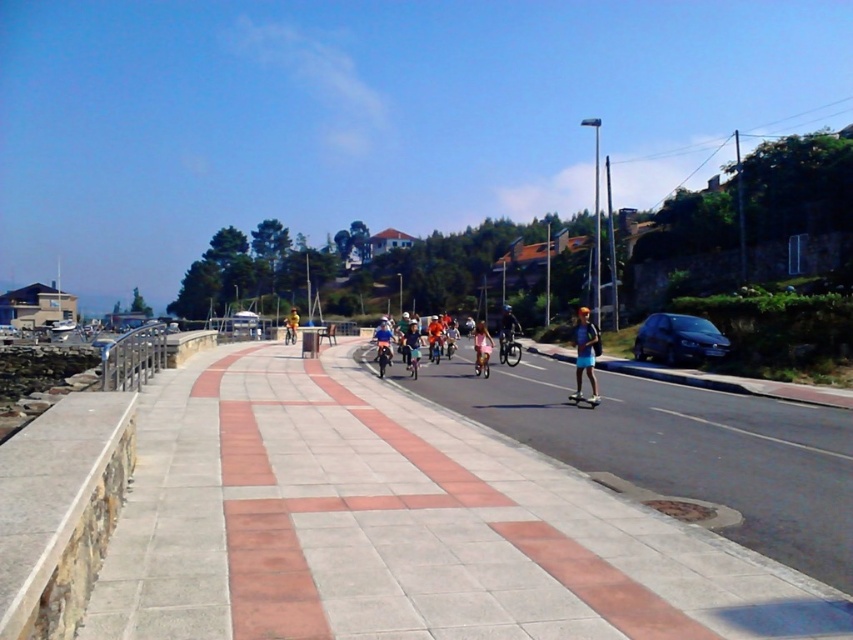
You are a photographer standing on the waterfront promenade. You want to capture a photo of the brick paved sidewalk at center without any people in the frame. Is the light blue shorts at center currently blocking your view of the sidewalk?

Yes, the brick paved sidewalk at center is positioned under light blue shorts at center, meaning the light blue shorts at center is blocking the view of the sidewalk.

You are a photographer trying to capture a candid shot of both the matte pink shorts at center and the matte blue helmet at center. Since you want to ensure both are clearly visible in the frame, which object should you adjust your focus on to account for their sizes?

The matte pink shorts at center are wider than the matte blue helmet at center, so you should focus on the matte pink shorts at center to ensure both are clearly visible in the frame.

Consider the image. You are standing at the point marked by the coordinates point (401, 525). You want to walk to the metal railing that borders the walkway. Which direction should you head?

The brick paved sidewalk at center is represented by point (401, 525). To reach the metal railing, you should head towards the right side of the walkway since the metal railing is on the opposite side from the stone wall.